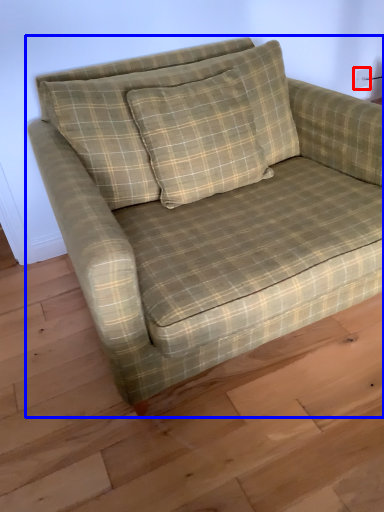
Question: Among these objects, which one is farthest to the camera, electric outlet (highlighted by a red box) or studio couch (highlighted by a blue box)?

Choices:
 (A) electric outlet
 (B) studio couch

Answer: (A)